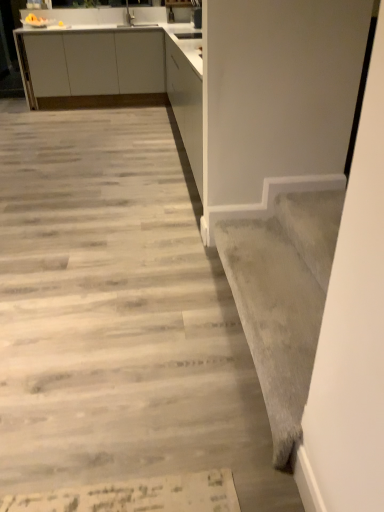
Question: Could gray wood floor at center be considered to be inside white matte cabinet at upper left?

Choices:
 (A) no
 (B) yes

Answer: (A)

Question: From a real-world perspective, is white matte cabinet at upper left under gray wood floor at center?

Choices:
 (A) no
 (B) yes

Answer: (A)

Question: Is white matte cabinet at upper left touching gray wood floor at center?

Choices:
 (A) yes
 (B) no

Answer: (B)

Question: Considering the relative sizes of white matte cabinet at upper left and gray wood floor at center in the image provided, is white matte cabinet at upper left bigger than gray wood floor at center?

Choices:
 (A) no
 (B) yes

Answer: (B)

Question: Does white matte cabinet at upper left have a lesser height compared to gray wood floor at center?

Choices:
 (A) no
 (B) yes

Answer: (A)

Question: Is gray wood floor at center at the back of white matte cabinet at upper left?

Choices:
 (A) yes
 (B) no

Answer: (B)

Question: Could you tell me if gray carpet at lower right is facing white matte cabinet at upper left?

Choices:
 (A) no
 (B) yes

Answer: (A)

Question: Is there a large distance between gray carpet at lower right and white matte cabinet at upper left?

Choices:
 (A) yes
 (B) no

Answer: (A)

Question: Is gray carpet at lower right taller than white matte cabinet at upper left?

Choices:
 (A) yes
 (B) no

Answer: (B)

Question: From a real-world perspective, is gray carpet at lower right located beneath white matte cabinet at upper left?

Choices:
 (A) no
 (B) yes

Answer: (B)

Question: Is white matte cabinet at upper left a part of gray carpet at lower right?

Choices:
 (A) no
 (B) yes

Answer: (A)

Question: From a real-world perspective, is gray carpet at lower right over white matte cabinet at upper left?

Choices:
 (A) yes
 (B) no

Answer: (B)

Question: Is the surface of white matte cabinet at upper left in direct contact with gray carpet at lower right?

Choices:
 (A) no
 (B) yes

Answer: (A)